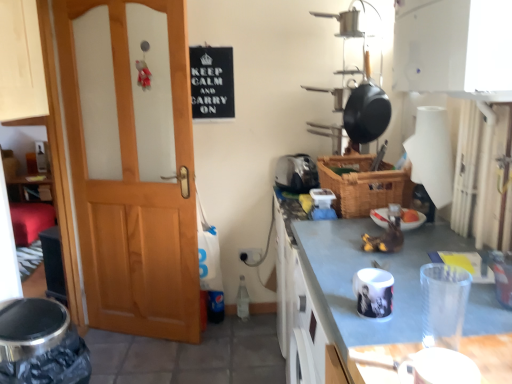
Find the location of a particular element. free space behind white glossy mug at center, which is counted as the fourth appliance, starting from the top is located at coordinates (346, 272).